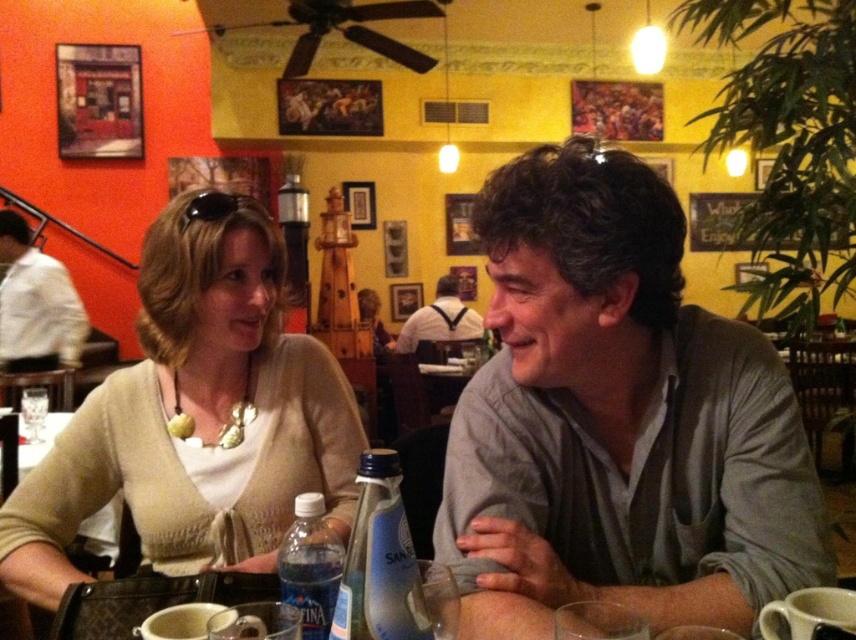
Question: Is gray matte shirt at center positioned behind matte beige sweater at lower left?

Choices:
 (A) no
 (B) yes

Answer: (A)

Question: Which of the following is the farthest from the observer?

Choices:
 (A) (465, 308)
 (B) (9, 304)

Answer: (A)

Question: Which of the following is the farthest from the observer?

Choices:
 (A) matte beige sweater at lower left
 (B) beige knit cardigan at center

Answer: (A)

Question: Is gray matte shirt at center below white shirt at center?

Choices:
 (A) yes
 (B) no

Answer: (A)

Question: Among these objects, which one is nearest to the camera?

Choices:
 (A) matte beige sweater at lower left
 (B) gray matte shirt at center
 (C) white shirt at left

Answer: (B)

Question: Considering the relative positions of gray matte shirt at center and matte beige sweater at lower left in the image provided, where is gray matte shirt at center located with respect to matte beige sweater at lower left?

Choices:
 (A) left
 (B) right

Answer: (B)